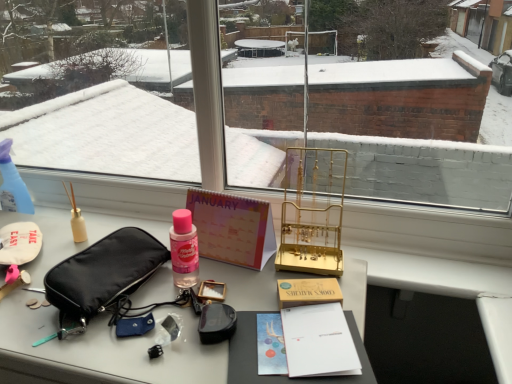
This screenshot has height=384, width=512. Identify the location of vacant area that is in front of pastel paper calendar at center. (220, 284).